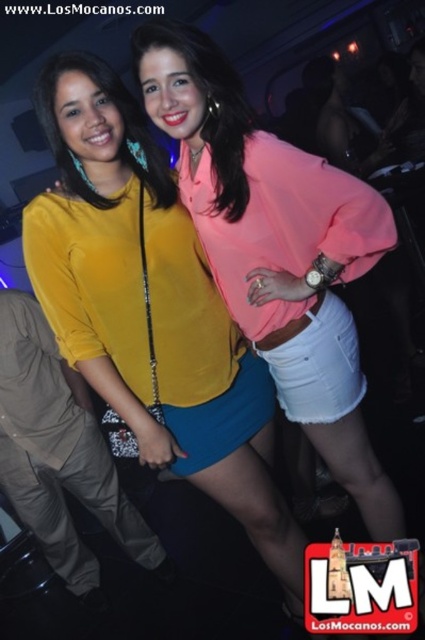
Question: Which point is farther from the camera taking this photo?

Choices:
 (A) (272, 308)
 (B) (48, 324)

Answer: (B)

Question: Does matte yellow blouse at center appear over pink satin blouse at center?

Choices:
 (A) yes
 (B) no

Answer: (B)

Question: Which object appears closest to the camera in this image?

Choices:
 (A) matte yellow blouse at center
 (B) pink satin blouse at center

Answer: (B)

Question: Which object appears farthest from the camera in this image?

Choices:
 (A) pink satin blouse at center
 (B) yellow fabric shorts at center

Answer: (B)

Question: Does matte yellow blouse at center appear on the left side of yellow fabric shorts at center?

Choices:
 (A) no
 (B) yes

Answer: (A)

Question: Does matte yellow blouse at center appear on the left side of pink satin blouse at center?

Choices:
 (A) no
 (B) yes

Answer: (B)